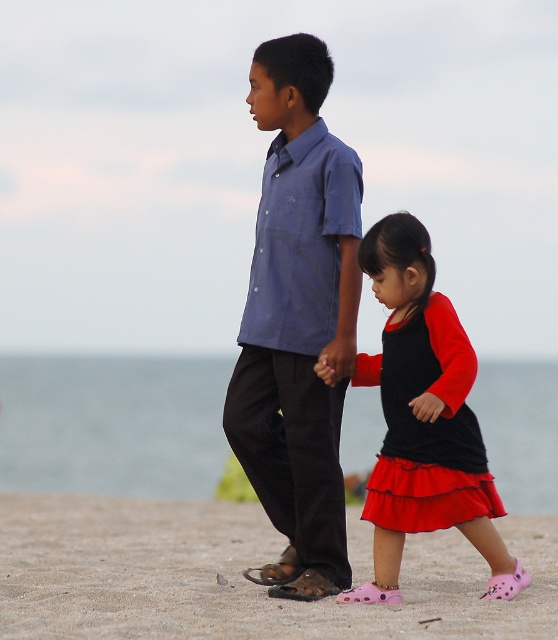
You are a photographer standing on the beach and want to take a picture of the sandy beach at lower center and the matte blue shirt at center. To ensure both are in focus, which object should you focus on first, the one closer to you or the one farther away?

The sandy beach at lower center is in front of the matte blue shirt at center, so it is closer to you. To ensure both are in focus, you should focus on the object farther away first, as depth of field typically extends further behind the point of focus than in front.

Looking at this image, you are standing on the beach and see two points marked on the sand. The first point is at coordinate point (x=295, y=547) and the second is at point (x=386, y=598). Which point is closer to you?

Point (x=295, y=547) is further to the camera than point (x=386, y=598), so the point closer to you is point (x=386, y=598).